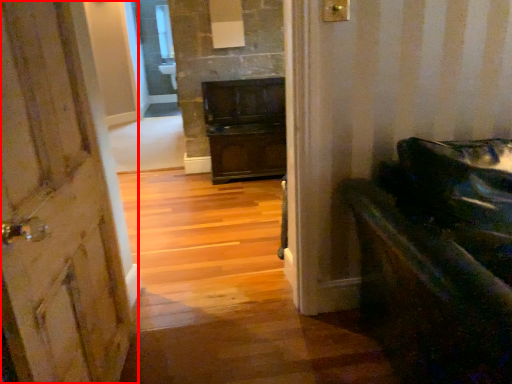
Question: From the image's perspective, what is the correct spatial relationship of door (annotated by the red box) in relation to furniture?

Choices:
 (A) above
 (B) below

Answer: (A)